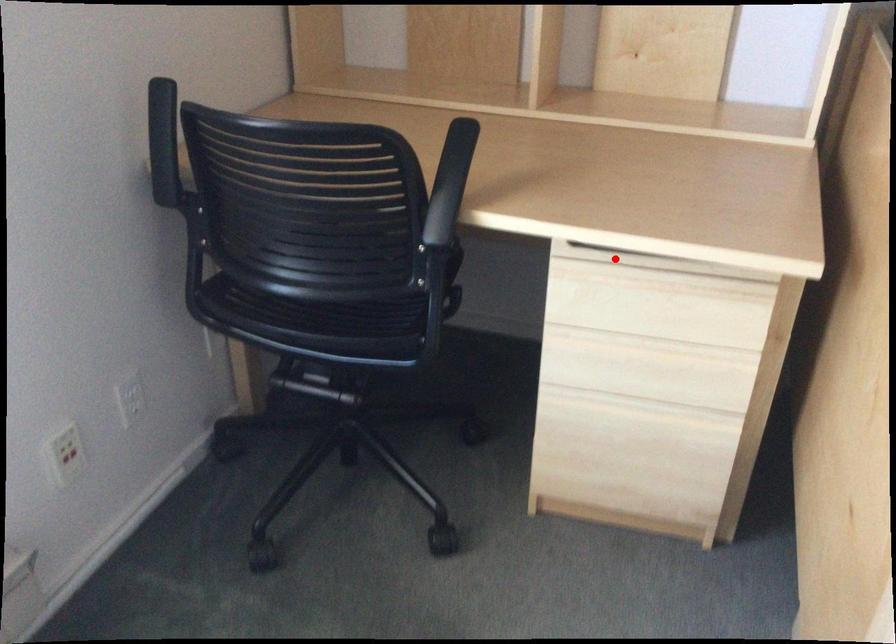
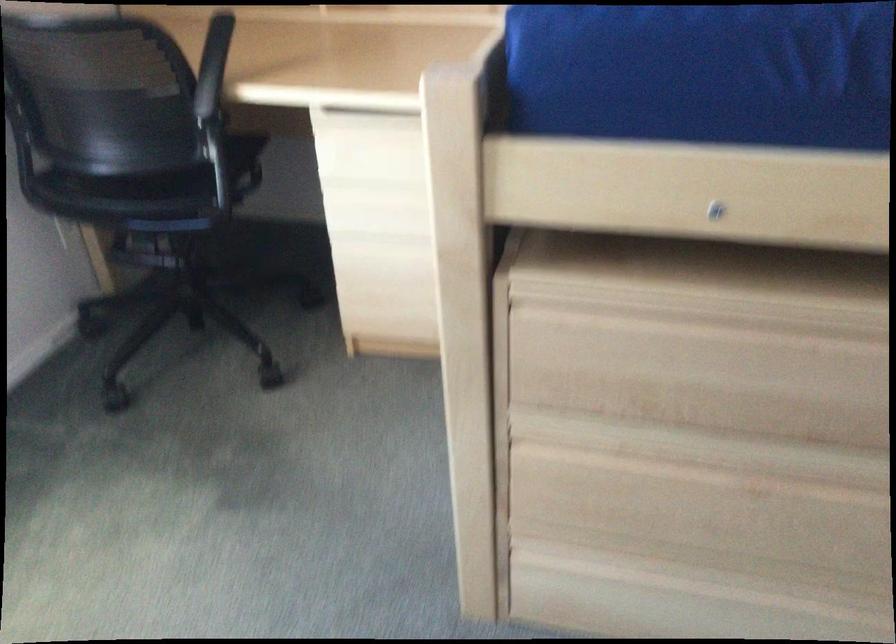
Question: I am providing you with two images of the same scene from different viewpoints. Given a red point in image1, look at the same physical point in image2. Is it:

Choices:
 (A) Closer to the viewpoint
 (B) Farther from the viewpoint

Answer: (B)